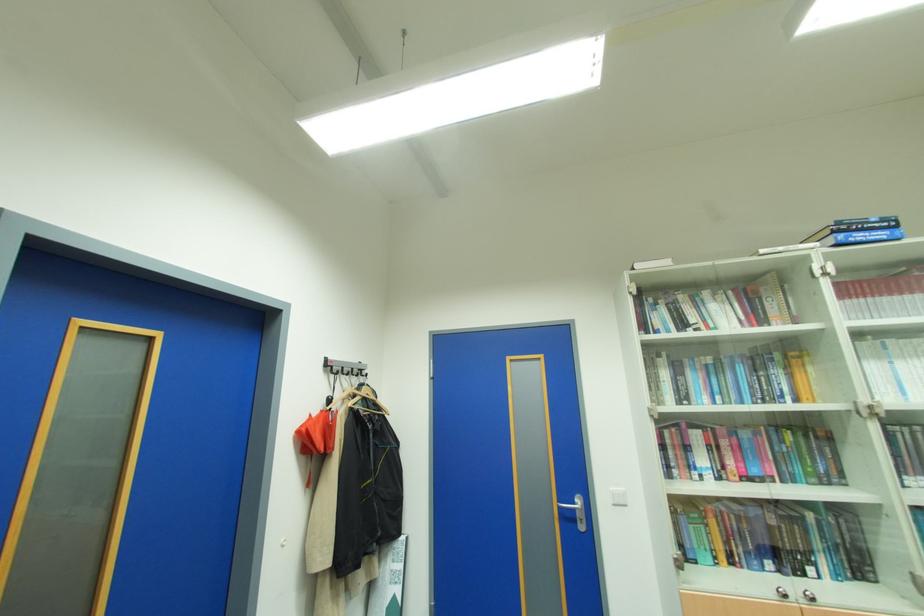
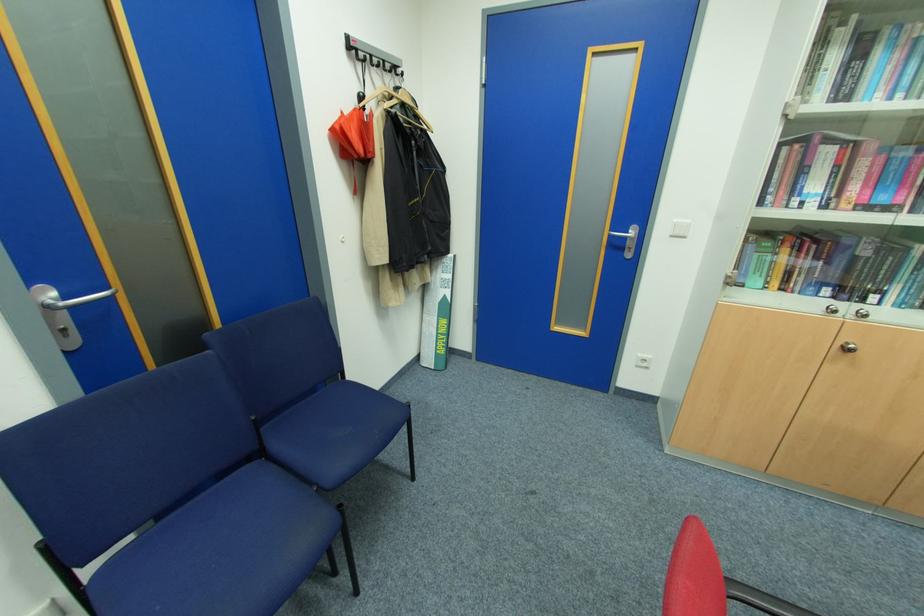
Locate, in the second image, the point that corresponds to the point at 349,370 in the first image.

(380, 60)